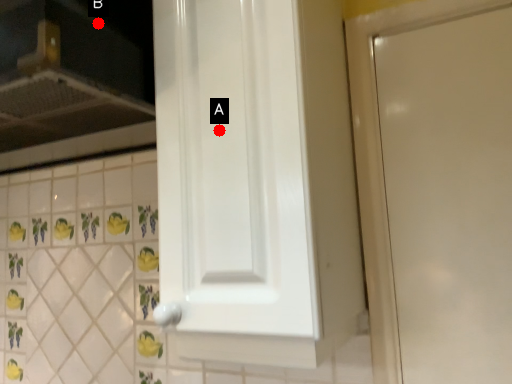
Question: Two points are circled on the image, labeled by A and B beside each circle. Which point is closer to the camera?

Choices:
 (A) A is closer
 (B) B is closer

Answer: (A)